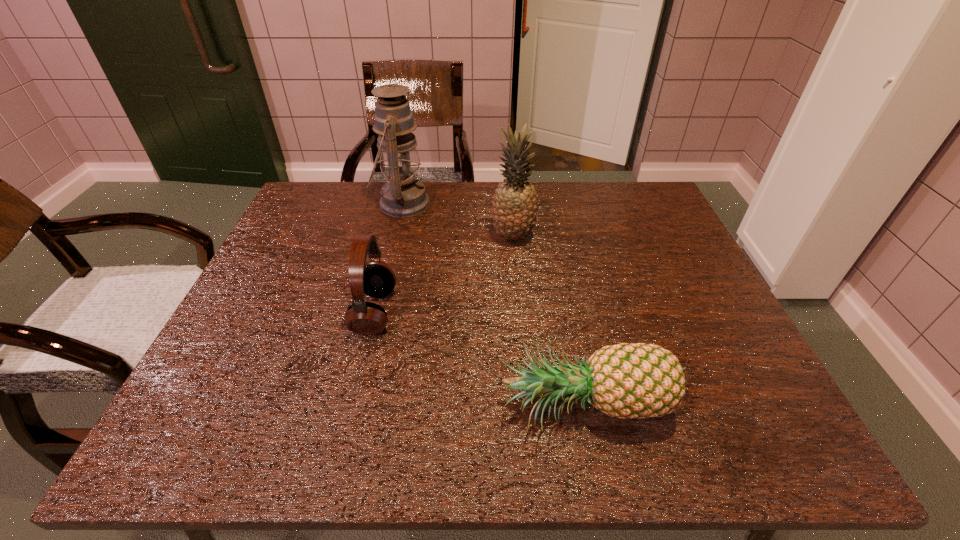
You are a GUI agent. You are given a task and a screenshot of the screen. Output one action in this format:
    pyautogui.click(x=<x>, y=<y>)
    Task: Click on the oil lamp
    The width and height of the screenshot is (960, 540).
    Given the screenshot: What is the action you would take?
    pyautogui.click(x=403, y=195)

Identify the location of the farther pineapple. (x=514, y=212).

Where is `the second shortest object`? The height and width of the screenshot is (540, 960). the second shortest object is located at coordinates pos(376,279).

This screenshot has width=960, height=540. What are the coordinates of `headset` in the screenshot? It's located at (376, 279).

This screenshot has width=960, height=540. I want to click on the nearest object, so click(639, 380).

Find the location of a particular element. the shortest object is located at coordinates (639, 380).

The height and width of the screenshot is (540, 960). In order to click on free space located on the left of the oil lamp in this screenshot , I will do `click(319, 204)`.

Locate an element on the screen. This screenshot has height=540, width=960. free space located on the right of the taller pineapple is located at coordinates (560, 237).

Find the location of a particular element. The height and width of the screenshot is (540, 960). vacant space located on the ear pads of the third farthest object is located at coordinates click(x=468, y=312).

Locate an element on the screen. This screenshot has width=960, height=540. blank area located 0.050m on the left of the shorter pineapple is located at coordinates (475, 408).